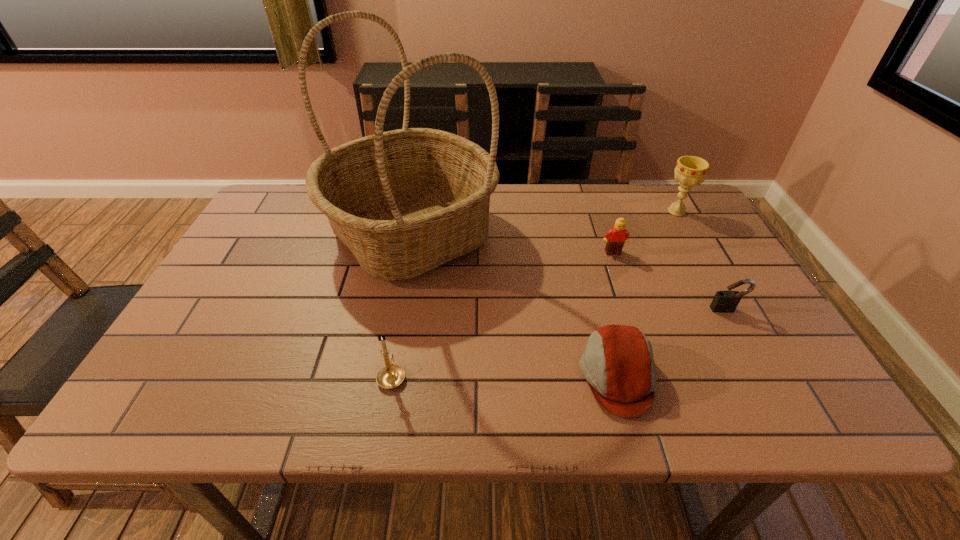
This screenshot has height=540, width=960. Identify the location of chalice located at the right edge. (690, 170).

Find the location of `padlock present at the right edge`. padlock present at the right edge is located at coordinates (724, 301).

Locate an element on the screen. This screenshot has height=540, width=960. object at the far right corner is located at coordinates (690, 170).

The height and width of the screenshot is (540, 960). In the image, there is a desktop. What are the coordinates of `vacant space at the near edge` in the screenshot? It's located at (241, 402).

This screenshot has height=540, width=960. I want to click on vacant position at the left edge of the desktop, so click(x=206, y=354).

Where is `vacant space at the right edge of the desktop`? vacant space at the right edge of the desktop is located at coordinates (709, 282).

This screenshot has width=960, height=540. In order to click on free space at the far left corner of the desktop in this screenshot , I will do (x=275, y=225).

The image size is (960, 540). In the image, there is a desktop. Identify the location of vacant area at the near left corner. pyautogui.click(x=177, y=384).

Locate an element on the screen. vacant space at the far right corner of the desktop is located at coordinates (675, 197).

Find the location of a particular element. vacant space in between the fifth shortest object and the padlock is located at coordinates coord(702,260).